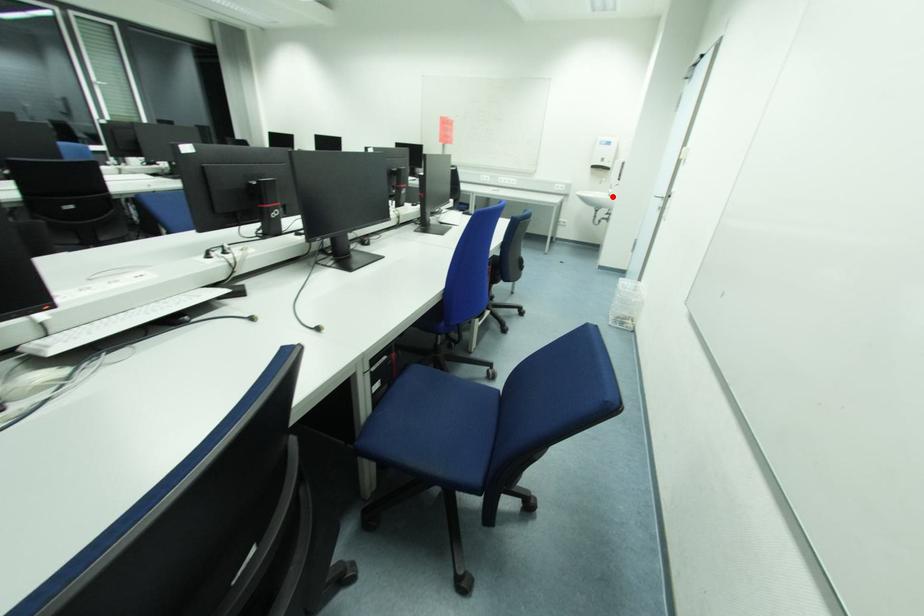
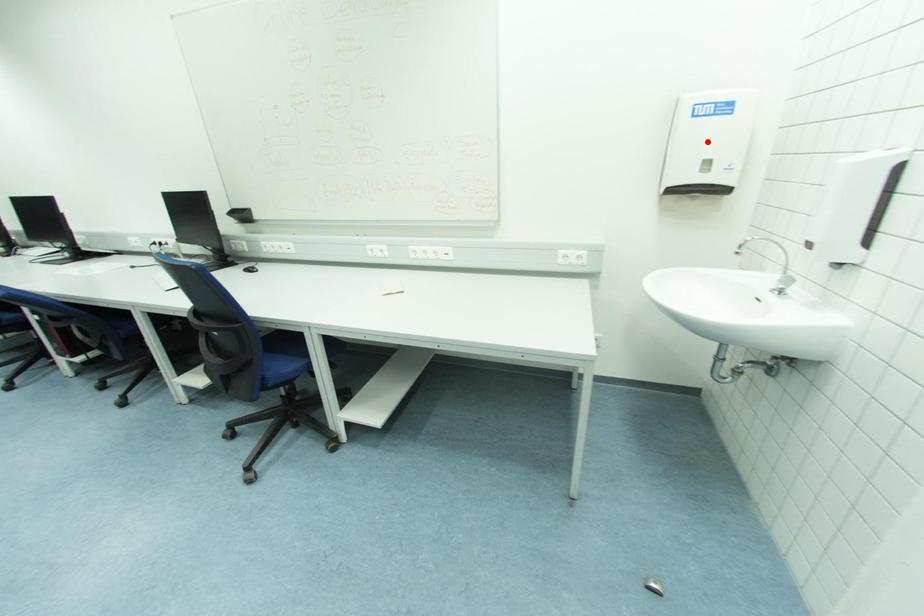
I am providing you with two images of the same scene from different viewpoints. A red point is marked on the first image and another point is marked on the second image. Does the point marked in image1 correspond to the same location as the one in image2?

No